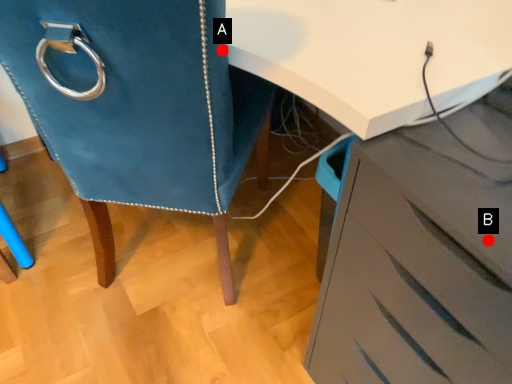
Question: Two points are circled on the image, labeled by A and B beside each circle. Which point appears farthest from the camera in this image?

Choices:
 (A) A is further
 (B) B is further

Answer: (A)